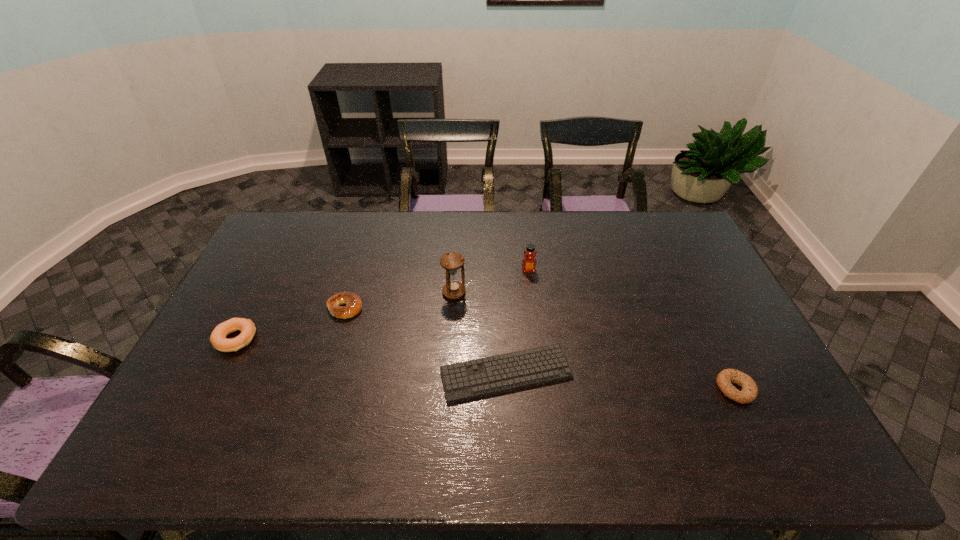
Identify which object is located as the second nearest to the farthest object. Please provide its 2D coordinates. Your answer should be formatted as a tuple, i.e. [(x, y)], where the tuple contains the x and y coordinates of a point satisfying the conditions above.

[(486, 376)]

Image resolution: width=960 pixels, height=540 pixels. In order to click on the second closest object relative to the rightmost object in this screenshot , I will do `click(529, 262)`.

The width and height of the screenshot is (960, 540). What are the coordinates of `the second closest bagel to the tallest bagel` in the screenshot? It's located at (749, 391).

This screenshot has height=540, width=960. Identify the location of bagel object that ranks as the closest to the second bagel from left to right. (218, 336).

In order to click on free location that satisfies the following two spatial constraints: 1. on the front side of the leftmost object; 2. on the left side of the shortest object in this screenshot , I will do `click(218, 374)`.